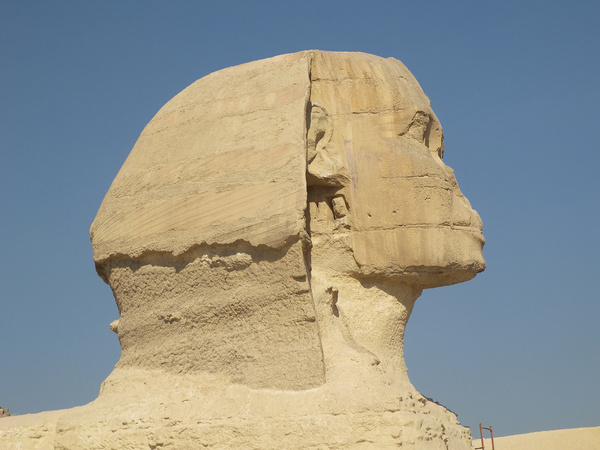
Image resolution: width=600 pixels, height=450 pixels. I want to click on sculpture, so click(354, 64).